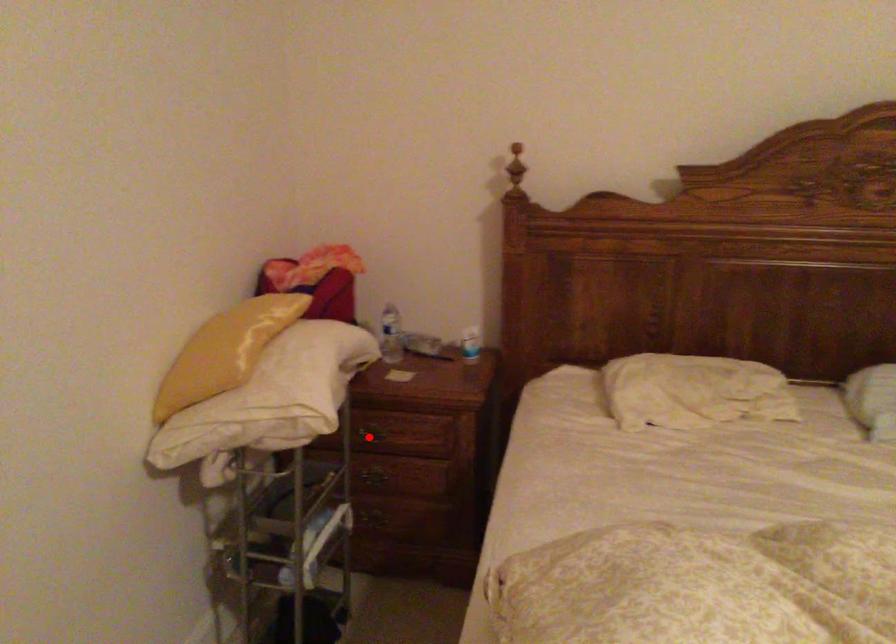
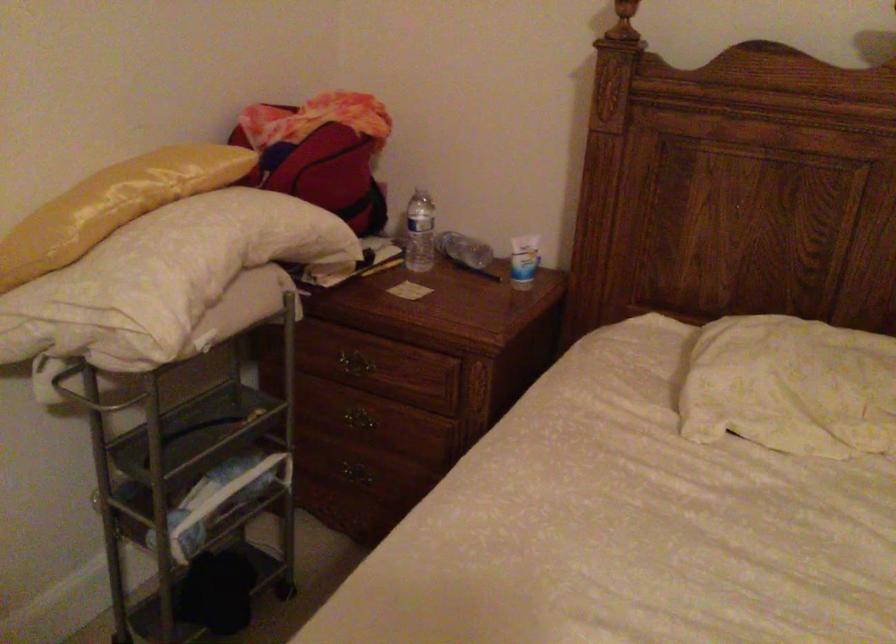
Question: I am providing you with two images of the same scene from different viewpoints. Given a red point in image1, look at the same physical point in image2. Is it:

Choices:
 (A) Closer to the viewpoint
 (B) Farther from the viewpoint

Answer: (A)